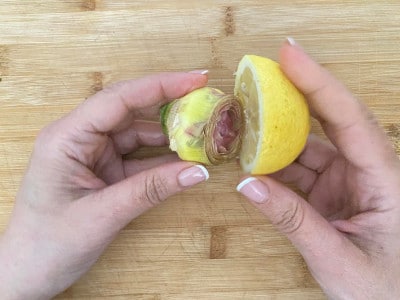
The image size is (400, 300). I want to click on wood table, so click(x=212, y=231).